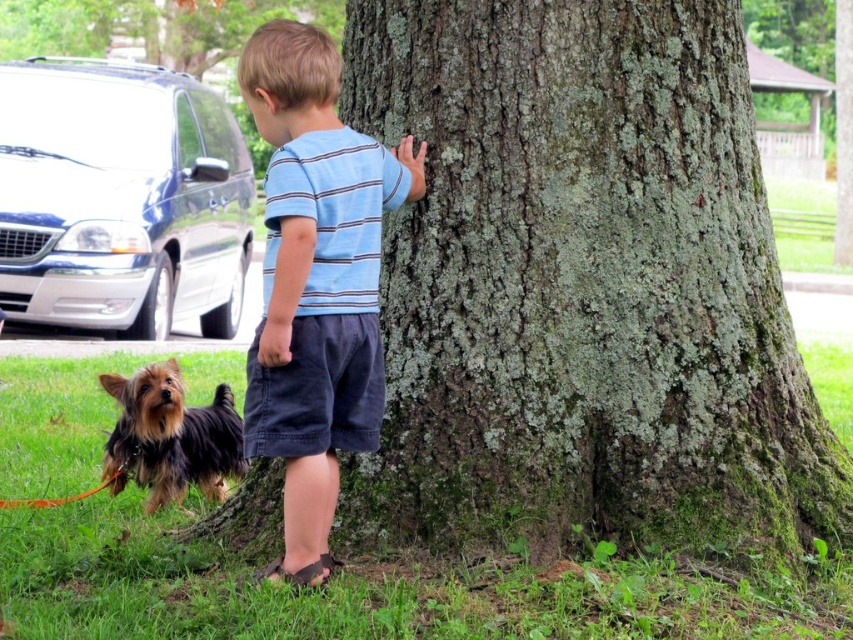
You are standing at the origin point of the coordinate system in the image. The blue striped shirt at center is located at point (316, 282). If you want to walk directly to the blue striped shirt at center, which direction should you move in terms of the coordinate system?

To reach the blue striped shirt at center located at point (316, 282), you should move towards the positive x and positive y directions in the coordinate system since the coordinates are both greater than zero.

Looking at this image, you are a photographer trying to capture the child and the dog in the scene. Since the blue striped shirt at center and shaggy brown fur at lower left are at different heights, which one should you focus on first if you want to ensure both are in focus?

The blue striped shirt at center is taller than the shaggy brown fur at lower left. To ensure both are in focus, you should focus on the blue striped shirt at center first, as focusing on the taller object will help capture the closer one in focus as well.

You are a photographer trying to capture a photo of both the blue striped shirt at center and the shaggy brown fur at lower left. Since you want both subjects to be in focus, which one should you adjust your camera focus on first?

You should focus on the blue striped shirt at center first because it is closer to the viewer than the shaggy brown fur at lower left, ensuring both will be in focus when using depth of field properly.